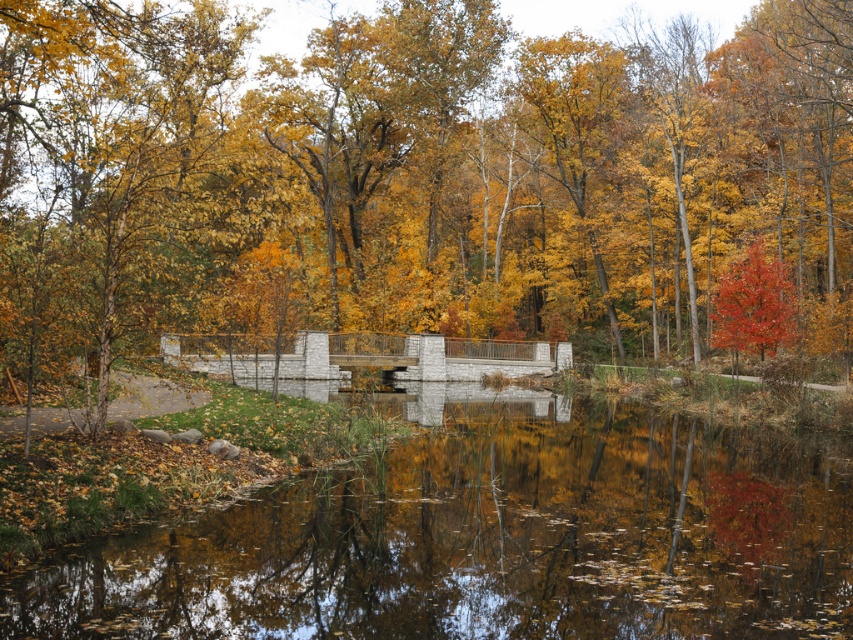
Question: Can you confirm if golden yellow leaves at center is positioned to the right of shiny red tree at right?

Choices:
 (A) no
 (B) yes

Answer: (A)

Question: Which point is farther from the camera taking this photo?

Choices:
 (A) (421, 97)
 (B) (814, 589)

Answer: (A)

Question: Estimate the real-world distances between objects in this image. Which object is farther from the smooth concrete lake at center?

Choices:
 (A) golden yellow leaves at center
 (B) shiny red tree at right

Answer: (A)

Question: Is golden yellow leaves at center thinner than shiny red tree at right?

Choices:
 (A) no
 (B) yes

Answer: (A)

Question: Is smooth concrete lake at center bigger than shiny red tree at right?

Choices:
 (A) no
 (B) yes

Answer: (A)

Question: Which point is farther to the camera?

Choices:
 (A) (679, 333)
 (B) (630, 508)

Answer: (A)